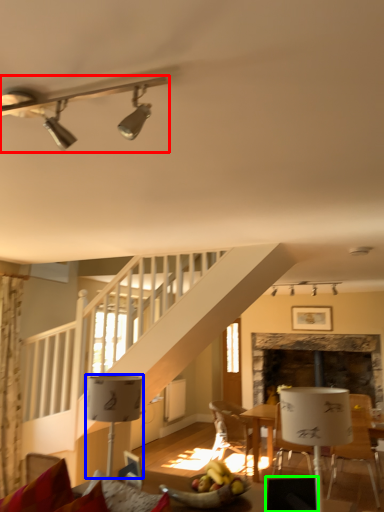
Question: Estimate the real-world distances between objects in this image. Which object is farther from lamp (highlighted by a red box), lamp (highlighted by a blue box) or armchair (highlighted by a green box)?

Choices:
 (A) lamp
 (B) armchair

Answer: (B)